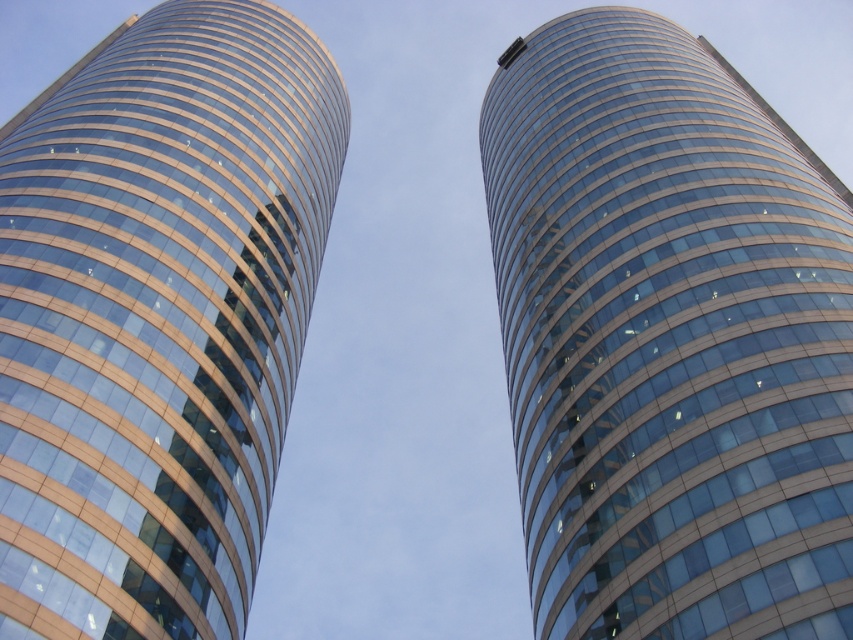
You are standing at the base of the glassy blue skyscraper at center. If you want to take a photo of it from a distance where it appears smaller in the frame, should you move closer or farther away?

To make the glassy blue skyscraper at center appear smaller in the frame, you should move farther away from it. Since it is currently 90.80 feet away, increasing the distance would reduce its apparent size in the photo.

You are standing at the base of the glassy blue skyscraper at center. Looking up, you notice a point marked at coordinates (x=669, y=339). Is this point located on the glassy blue skyscraper at center?

Yes, the glassy blue skyscraper at center is located at point (x=669, y=339), so the point is on the glassy blue skyscraper at center.

You are an architect reviewing the blueprints of two skyscrapers. The glassy blue skyscraper at center and the matte glass building at center are part of a proposed development. Based on the image provided, which of the two buildings appears to be the taller one?

The matte glass building at center is taller than the glassy blue skyscraper at center according to the image.